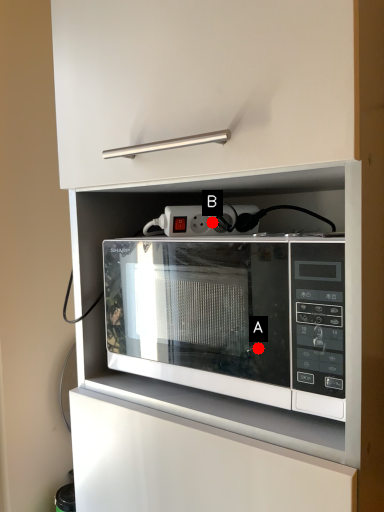
Question: Two points are circled on the image, labeled by A and B beside each circle. Which point appears closest to the camera in this image?

Choices:
 (A) A is closer
 (B) B is closer

Answer: (A)